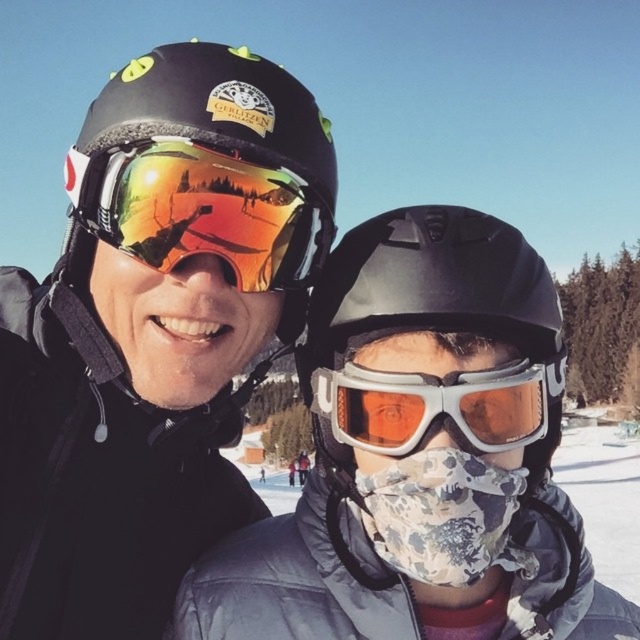
Question: Is matte black helmet at upper center further to the viewer compared to white matte goggles at center?

Choices:
 (A) yes
 (B) no

Answer: (A)

Question: Does matte black helmet at upper center have a smaller size compared to matte reflective goggles at center?

Choices:
 (A) yes
 (B) no

Answer: (B)

Question: Among these points, which one is nearest to the camera?

Choices:
 (A) (419, 445)
 (B) (193, 305)
 (C) (292, 280)
 (D) (403, 266)

Answer: (A)

Question: Which of the following is the closest to the observer?

Choices:
 (A) matte black helmet at upper center
 (B) matte reflective goggles at center
 (C) white matte goggles at center
 (D) matte black helmet at center

Answer: (C)

Question: Can you confirm if matte reflective goggles at center is positioned below white matte goggles at center?

Choices:
 (A) yes
 (B) no

Answer: (B)

Question: Which of the following is the farthest from the observer?

Choices:
 (A) (257, 172)
 (B) (212, 392)

Answer: (B)